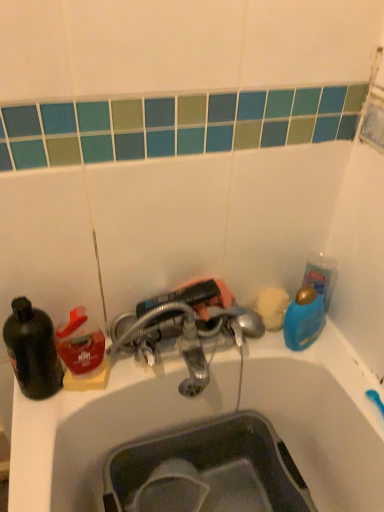
Question: Does translucent plastic bottle at left have a lesser width compared to metallic silver faucet at center?

Choices:
 (A) no
 (B) yes

Answer: (B)

Question: Is translucent plastic bottle at left not close to metallic silver faucet at center?

Choices:
 (A) yes
 (B) no

Answer: (B)

Question: Can you confirm if translucent plastic bottle at left is taller than metallic silver faucet at center?

Choices:
 (A) yes
 (B) no

Answer: (A)

Question: Does translucent plastic bottle at left contain metallic silver faucet at center?

Choices:
 (A) yes
 (B) no

Answer: (B)

Question: Is translucent plastic bottle at left further to the viewer compared to metallic silver faucet at center?

Choices:
 (A) yes
 (B) no

Answer: (A)

Question: Is translucent plastic bottle at left turned away from metallic silver faucet at center?

Choices:
 (A) yes
 (B) no

Answer: (B)

Question: Is matte gray sink at lower center wider than black matte bottle at left?

Choices:
 (A) yes
 (B) no

Answer: (A)

Question: Does matte gray sink at lower center lie in front of black matte bottle at left?

Choices:
 (A) no
 (B) yes

Answer: (A)

Question: Are matte gray sink at lower center and black matte bottle at left beside each other?

Choices:
 (A) yes
 (B) no

Answer: (B)

Question: Is matte gray sink at lower center taller than black matte bottle at left?

Choices:
 (A) no
 (B) yes

Answer: (A)

Question: Is matte gray sink at lower center thinner than black matte bottle at left?

Choices:
 (A) yes
 (B) no

Answer: (B)

Question: From the image's perspective, is matte gray sink at lower center on top of black matte bottle at left?

Choices:
 (A) yes
 (B) no

Answer: (B)

Question: Considering the relative positions of matte gray sink at lower center and blue glossy bottle at upper right in the image provided, is matte gray sink at lower center in front of blue glossy bottle at upper right?

Choices:
 (A) yes
 (B) no

Answer: (A)